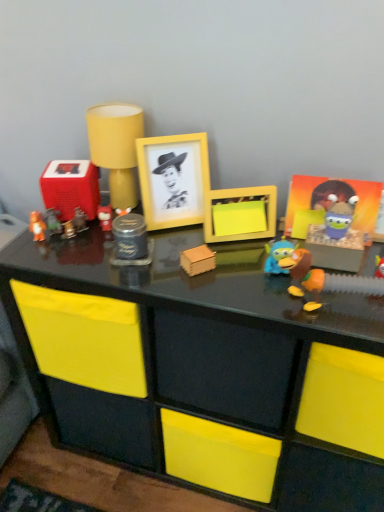
Question: From the image's perspective, is metallic brown figurine at left, the 5th toy when ordered from left to right, positioned above or below matte yellow lampshade at upper center, positioned as the seventh toy in left-to-right order?

Choices:
 (A) below
 (B) above

Answer: (A)

Question: In terms of width, does metallic brown figurine at left, which ranks as the eighth toy in right-to-left order, look wider or thinner when compared to matte yellow lampshade at upper center, which is the 6th toy in right-to-left order?

Choices:
 (A) wide
 (B) thin

Answer: (B)

Question: Which of these objects is positioned farthest from the shiny metallic can at center, positioned as the 5th toy in right-to-left order?

Choices:
 (A) orange matte bear at left, the twelfth toy in the right-to-left sequence
 (B) yellow matte picture frame at upper center
 (C) matte black hello kitty at center, which appears as the 7th toy when viewed from the right
 (D) yellow matte frame at center, which is counted as the tenth toy, starting from the left
 (E) matte yellow lampshade at upper center, positioned as the seventh toy in left-to-right order

Answer: (A)

Question: Which object is positioned farthest from the matte black hello kitty at center, which appears as the 7th toy when viewed from the right?

Choices:
 (A) wooden block at center, which is counted as the 4th toy, starting from the right
 (B) metallic brown figurine at left, which ranks as the eighth toy in right-to-left order
 (C) metallic gold toy at center-left, marked as the 9th toy in a right-to-left arrangement
 (D) matte yellow lampshade at upper center, positioned as the seventh toy in left-to-right order
 (E) orange matte bear at left, the twelfth toy in the right-to-left sequence

Answer: (A)